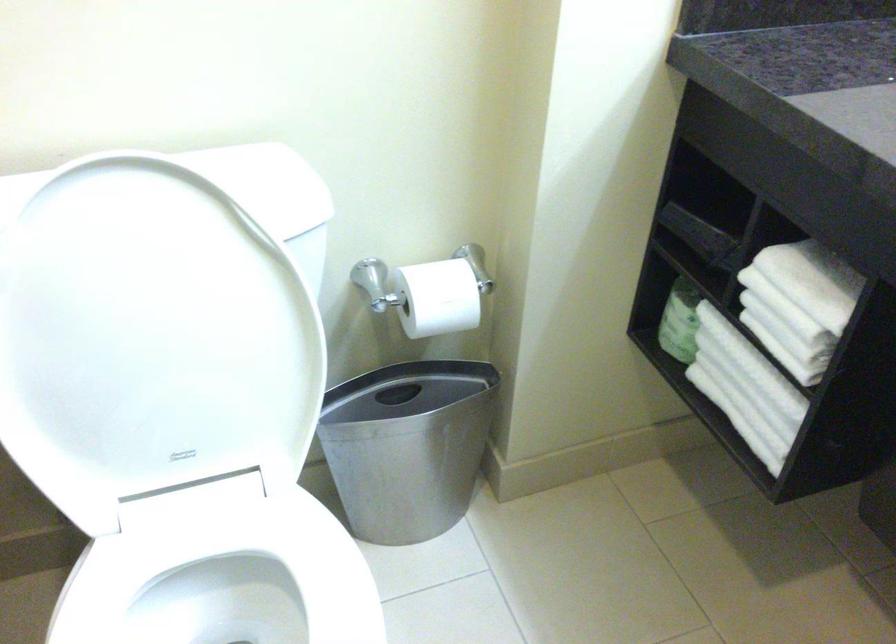
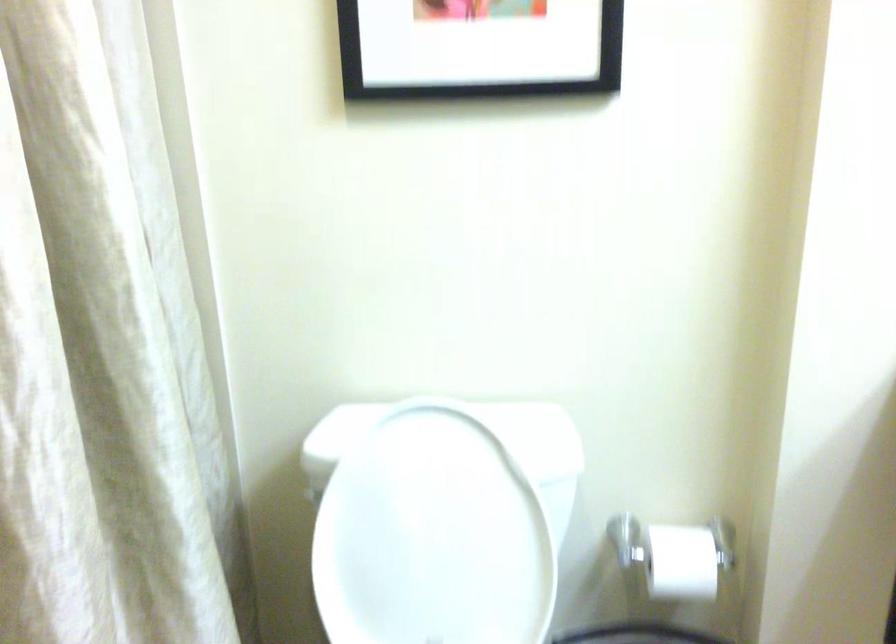
The images are taken continuously from a first-person perspective. In which direction is your viewpoint rotating?

The camera's rotation is toward left-up.